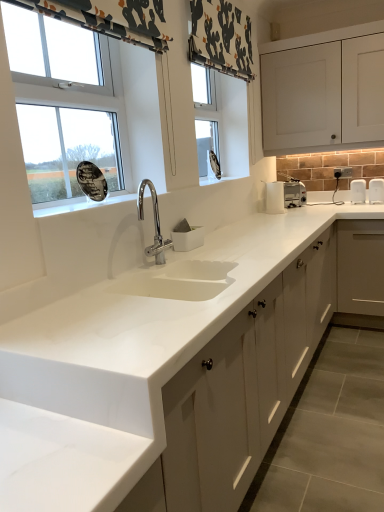
Question: Does white matte cabinet at upper right, the first cabinetry from the top, have a greater height compared to white matte cabinet at center, which is the second cabinetry from top to bottom?

Choices:
 (A) no
 (B) yes

Answer: (A)

Question: Is white matte cabinet at upper right, which appears as the second cabinetry when ordered from the bottom, further to camera compared to white matte cabinet at center, placed as the 1th cabinetry when sorted from bottom to top?

Choices:
 (A) no
 (B) yes

Answer: (B)

Question: Is white matte cabinet at upper right, which appears as the second cabinetry when ordered from the bottom, to the right of white matte cabinet at center, placed as the 1th cabinetry when sorted from bottom to top, from the viewer's perspective?

Choices:
 (A) no
 (B) yes

Answer: (B)

Question: Is white matte cabinet at center, placed as the 1th cabinetry when sorted from bottom to top, a part of white matte cabinet at upper right, which appears as the second cabinetry when ordered from the bottom?

Choices:
 (A) yes
 (B) no

Answer: (B)

Question: Can you confirm if white matte cabinet at upper right, the first cabinetry from the top, is wider than white matte cabinet at center, which is the second cabinetry from top to bottom?

Choices:
 (A) yes
 (B) no

Answer: (B)

Question: Is white matte cabinet at upper right, which appears as the second cabinetry when ordered from the bottom, bigger than white matte cabinet at center, which is the second cabinetry from top to bottom?

Choices:
 (A) yes
 (B) no

Answer: (B)

Question: From the image's perspective, does white glossy window at upper left appear higher than white matte cabinet at upper right, the first cabinetry from the top?

Choices:
 (A) yes
 (B) no

Answer: (B)

Question: From a real-world perspective, is white glossy window at upper left positioned under white matte cabinet at upper right, which appears as the second cabinetry when ordered from the bottom, based on gravity?

Choices:
 (A) no
 (B) yes

Answer: (B)

Question: Does white glossy window at upper left have a lesser width compared to white matte cabinet at upper right, the first cabinetry from the top?

Choices:
 (A) yes
 (B) no

Answer: (A)

Question: Does white glossy window at upper left have a larger size compared to white matte cabinet at upper right, which appears as the second cabinetry when ordered from the bottom?

Choices:
 (A) no
 (B) yes

Answer: (A)

Question: Is white glossy window at upper left oriented towards white matte cabinet at upper right, which appears as the second cabinetry when ordered from the bottom?

Choices:
 (A) yes
 (B) no

Answer: (B)

Question: Is white glossy window at upper left located outside white matte cabinet at upper right, which appears as the second cabinetry when ordered from the bottom?

Choices:
 (A) yes
 (B) no

Answer: (A)

Question: Is white matte cabinet at center, placed as the 1th cabinetry when sorted from bottom to top, oriented away from patterned fabric curtain at upper left?

Choices:
 (A) yes
 (B) no

Answer: (B)